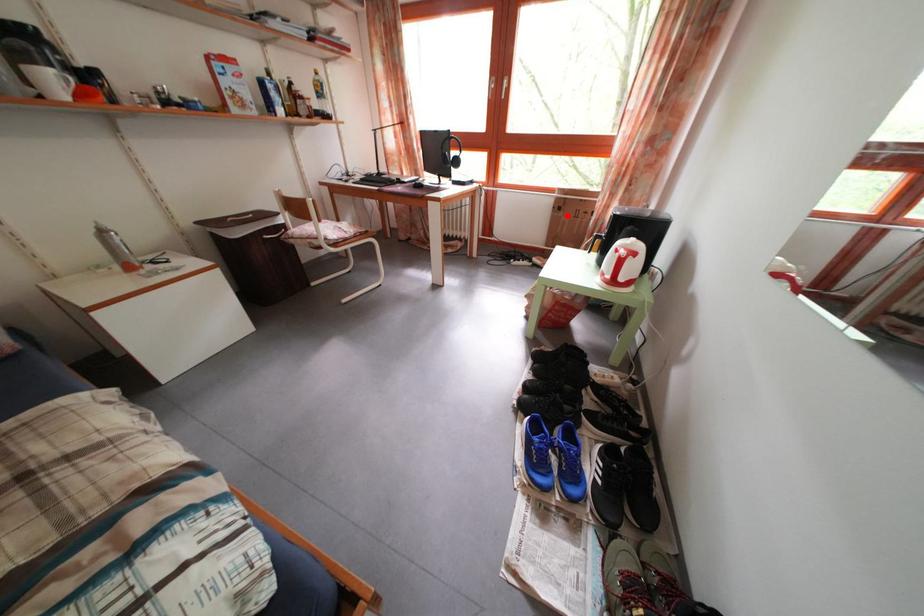
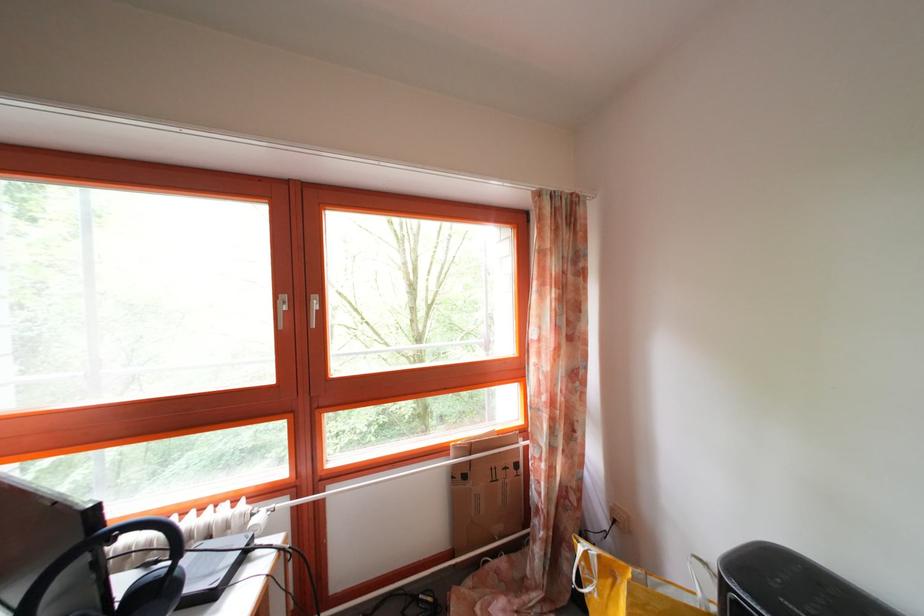
Question: A red point is marked in image1. In image2, is the corresponding 3D point closer to the camera or farther? Reply with the corresponding letter.

Choices:
 (A) The corresponding 3D point is closer.
 (B) The corresponding 3D point is farther.

Answer: (B)